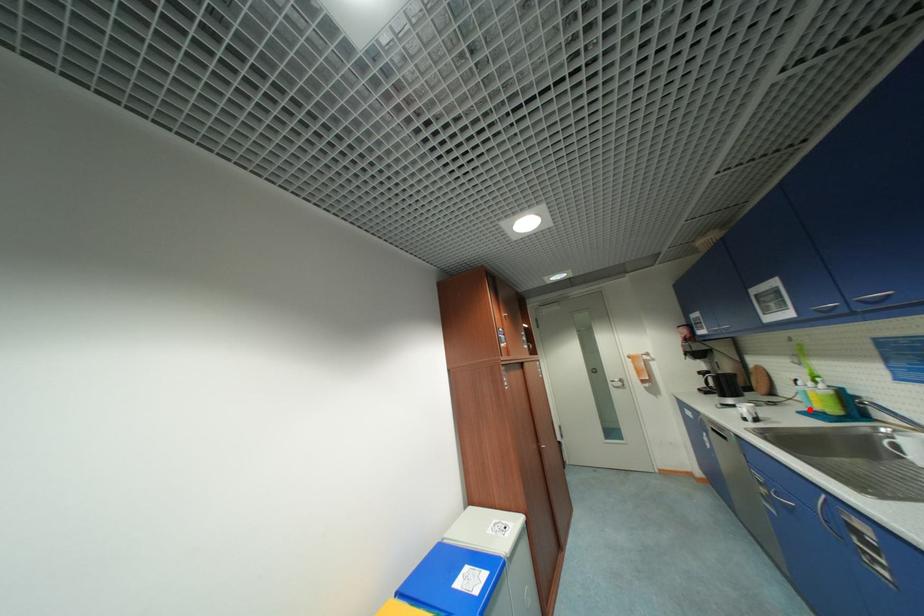
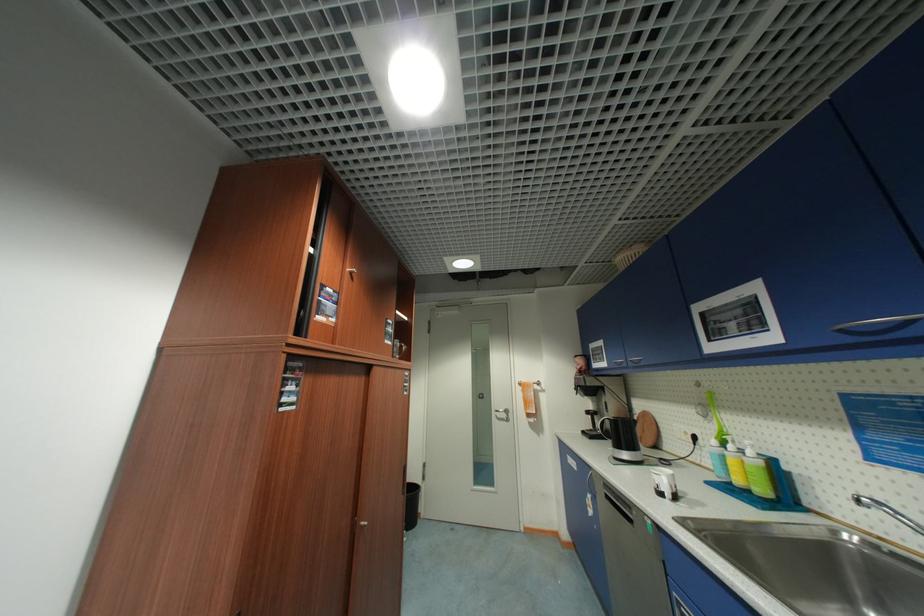
Find the pixel in the second image that matches the highlighted location in the first image.

(719, 479)